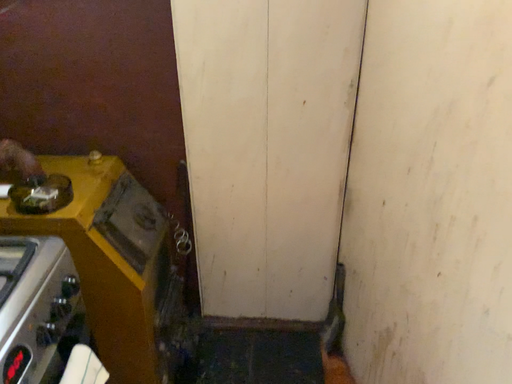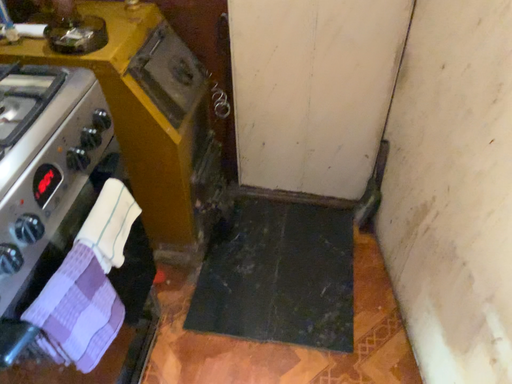
Question: Which way did the camera rotate in the video?

Choices:
 (A) rotated downward
 (B) rotated upward

Answer: (A)